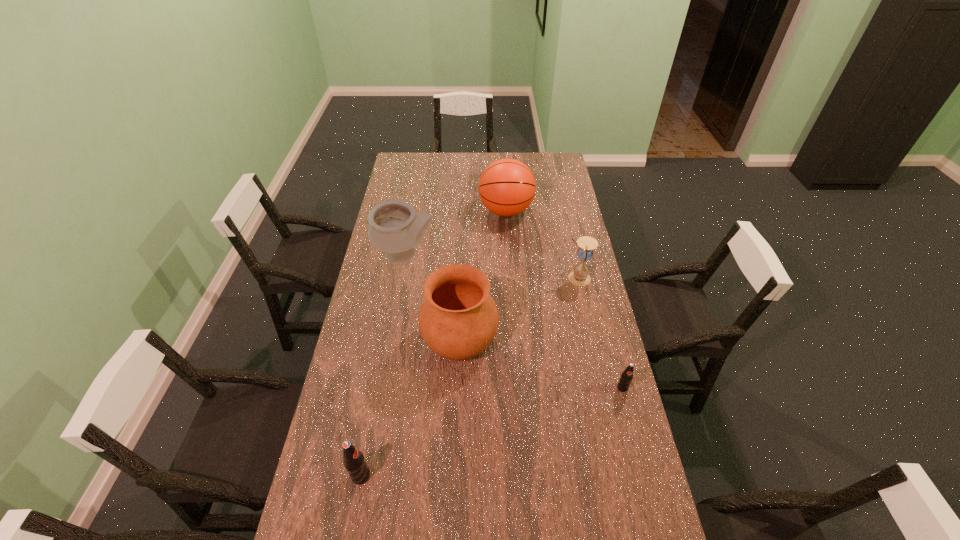
This screenshot has width=960, height=540. What are the coordinates of `object that is the closest to the farther pottery` in the screenshot? It's located at (507, 187).

What are the coordinates of `free space that satisfies the following two spatial constraints: 1. on the front side of the third nearest object; 2. on the front label of the nearest object` in the screenshot? It's located at (454, 476).

The width and height of the screenshot is (960, 540). In order to click on free location that satisfies the following two spatial constraints: 1. on the front side of the farther pottery; 2. on the front label of the left pop in this screenshot , I will do `click(367, 476)`.

Find the location of a particular element. vacant space that satisfies the following two spatial constraints: 1. on the front side of the nearer pottery; 2. on the left side of the farther pottery is located at coordinates (391, 340).

In order to click on free space that satisfies the following two spatial constraints: 1. on the back side of the basketball; 2. on the left side of the farther pottery in this screenshot , I will do `click(413, 211)`.